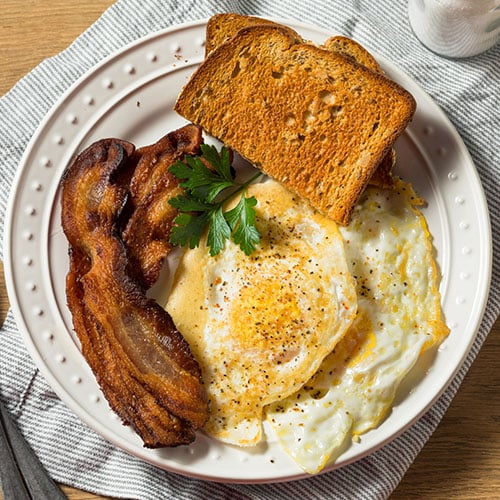
In order to click on place mat in this screenshot , I will do `click(397, 42)`.